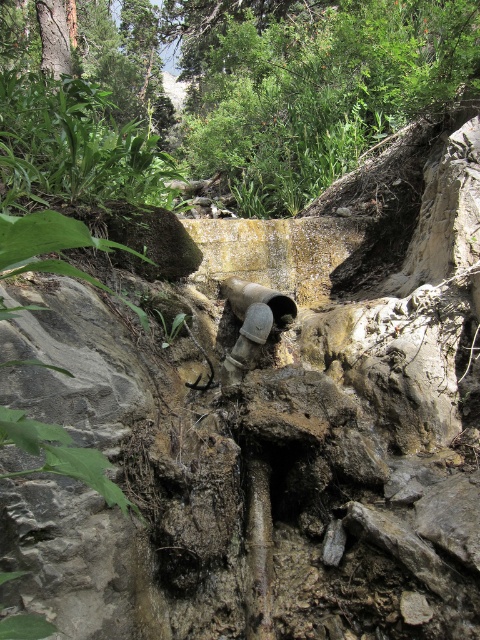
Question: Is green leafy tree at upper center smaller than matte gray water pipe at center?

Choices:
 (A) no
 (B) yes

Answer: (B)

Question: Which of the following is the closest to the observer?

Choices:
 (A) green leafy tree at upper center
 (B) matte gray water pipe at center

Answer: (B)

Question: Which point is closer to the camera?

Choices:
 (A) matte gray water pipe at center
 (B) green leafy tree at upper center

Answer: (A)

Question: From the image, what is the correct spatial relationship of green leafy tree at upper center in relation to matte gray water pipe at center?

Choices:
 (A) above
 (B) below

Answer: (A)

Question: Is green leafy tree at upper center to the right of matte gray water pipe at center from the viewer's perspective?

Choices:
 (A) no
 (B) yes

Answer: (A)